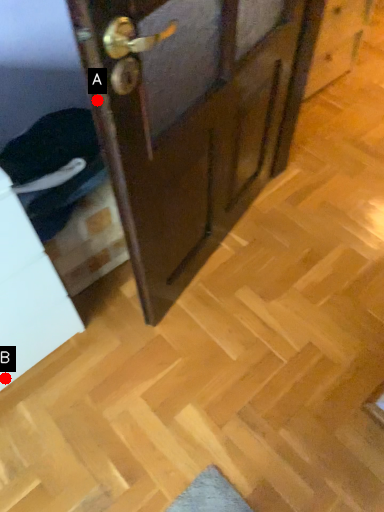
Question: Two points are circled on the image, labeled by A and B beside each circle. Which of the following is the closest to the observer?

Choices:
 (A) A is closer
 (B) B is closer

Answer: (A)